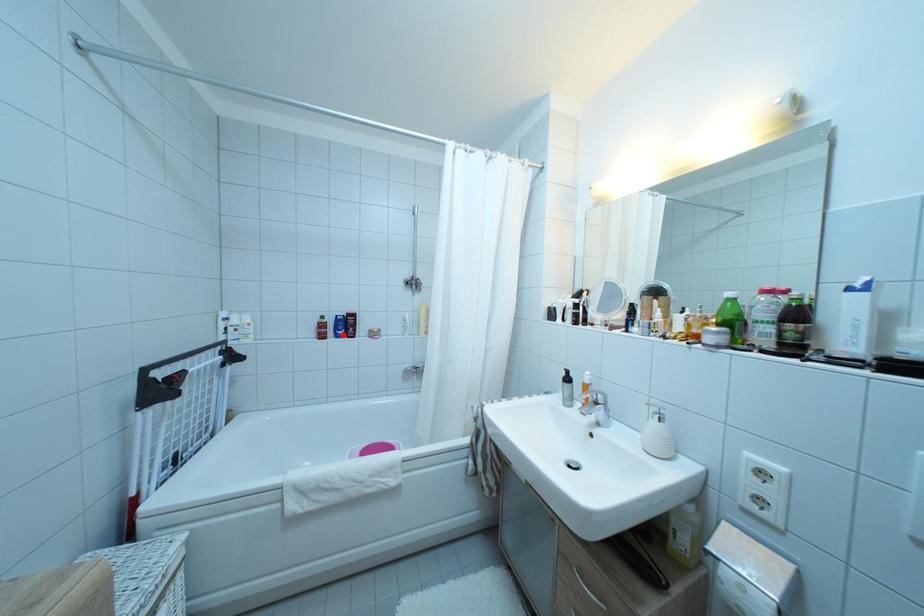
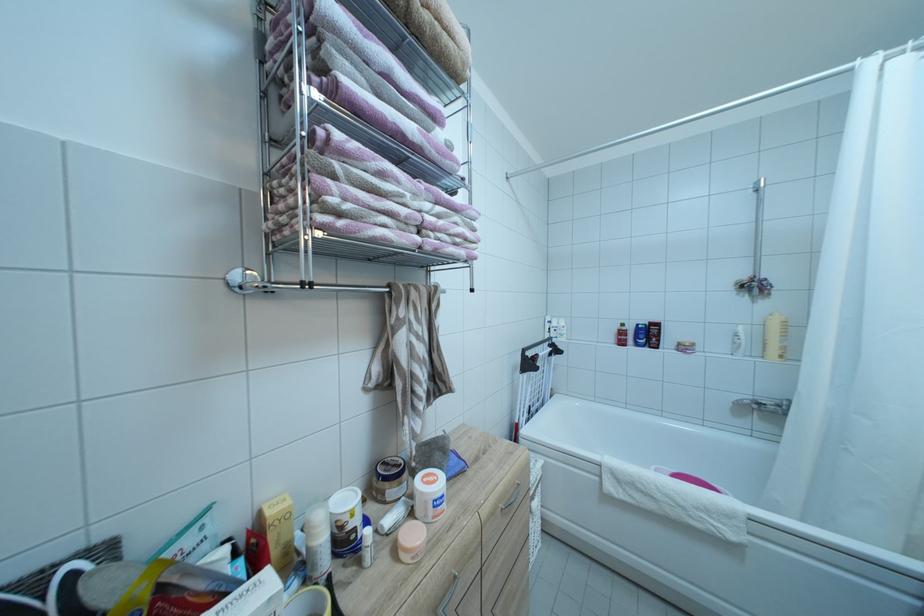
Find the pixel in the second image that matches the highlighted location in the first image.

(642, 342)